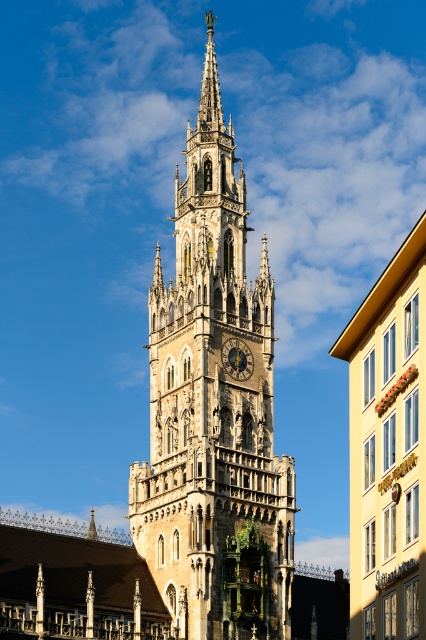
What do you see at coordinates (388, 449) in the screenshot? The image size is (426, 640). I see `yellow matte building at right` at bounding box center [388, 449].

Identify the location of yellow matte building at right. (388, 449).

What do you see at coordinates (213, 410) in the screenshot? I see `golden stone clock tower at center` at bounding box center [213, 410].

Is point (189, 486) more distant than point (400, 618)?

Yes, it is.

Where is `golden stone clock tower at center`? The width and height of the screenshot is (426, 640). golden stone clock tower at center is located at coordinates (213, 410).

Between golden stone clock tower at center and golden polished metal clock at center, which one appears on the right side from the viewer's perspective?

Positioned to the right is golden polished metal clock at center.

Which is in front, point (268, 353) or point (236, 339)?

Positioned in front is point (236, 339).

Locate an element on the screen. This screenshot has height=640, width=426. golden stone clock tower at center is located at coordinates (213, 410).